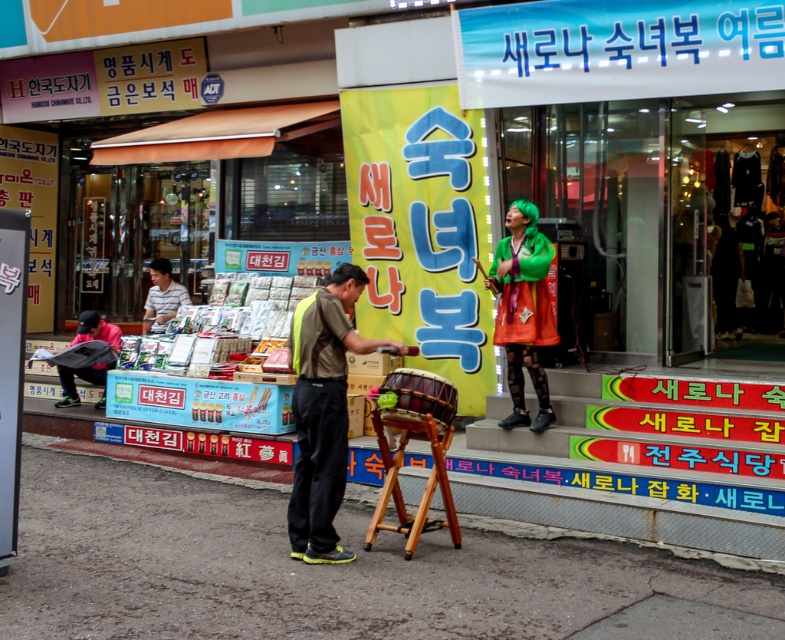
Measure the distance between green felt hat at upper center and striped shirt at center.

green felt hat at upper center is 4.47 meters from striped shirt at center.

Which of these two, green felt hat at upper center or striped shirt at center, stands shorter?

striped shirt at center

Where is `green felt hat at upper center`? green felt hat at upper center is located at coordinates (524, 308).

Between brown fabric street vendor at center and striped shirt at center, which one has more height?

With more height is brown fabric street vendor at center.

Is brown fabric street vendor at center bigger than striped shirt at center?

Yes, brown fabric street vendor at center is bigger than striped shirt at center.

Image resolution: width=785 pixels, height=640 pixels. I want to click on brown fabric street vendor at center, so (x=322, y=412).

I want to click on brown fabric street vendor at center, so coord(322,412).

Consider the image. How far apart are brown fabric street vendor at center and wooden stool at center?

brown fabric street vendor at center and wooden stool at center are 22.71 inches apart from each other.

Which of these two, brown fabric street vendor at center or wooden stool at center, stands taller?

With more height is brown fabric street vendor at center.

Locate an element on the screen. The height and width of the screenshot is (640, 785). brown fabric street vendor at center is located at coordinates (322, 412).

Locate an element on the screen. The image size is (785, 640). brown fabric street vendor at center is located at coordinates (322, 412).